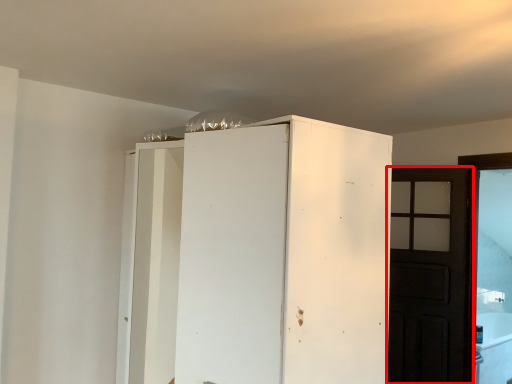
Question: Where is door (annotated by the red box) located in relation to cupboard in the image?

Choices:
 (A) left
 (B) right

Answer: (B)